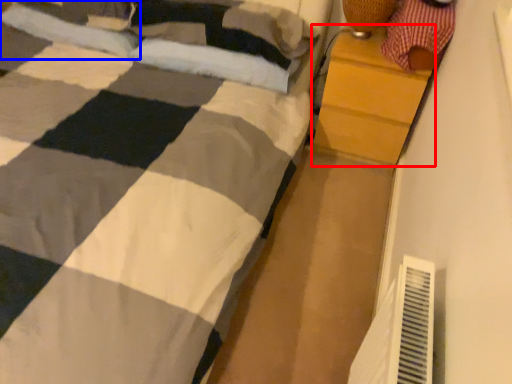
Question: Which point is closer to the camera, chest of drawers (highlighted by a red box) or pillow (highlighted by a blue box)?

Choices:
 (A) chest of drawers
 (B) pillow

Answer: (A)